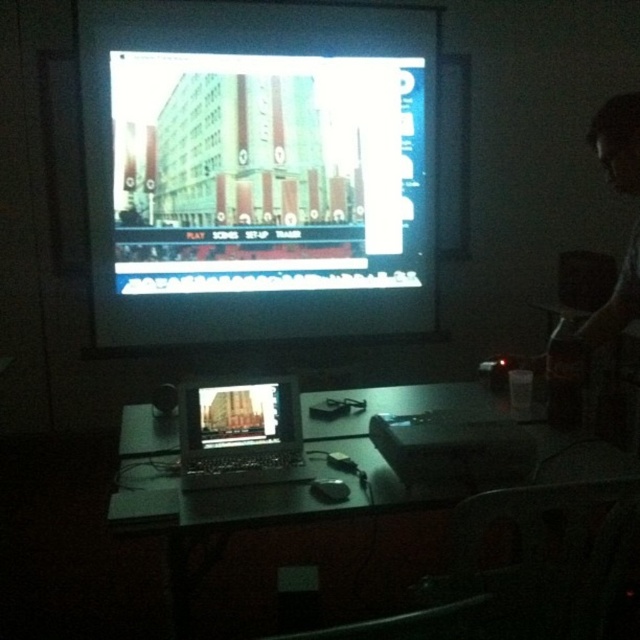
Is bright glossy screen at upper center taller than metallic silver laptop at lower center?

Indeed, bright glossy screen at upper center has a greater height compared to metallic silver laptop at lower center.

Does point (298, 74) come farther from viewer compared to point (387, 404)?

Yes.

You are a GUI agent. You are given a task and a screenshot of the screen. Output one action in this format:
    pyautogui.click(x=<x>, y=<y>)
    Task: Click on the bright glossy screen at upper center
    Image resolution: width=640 pixels, height=640 pixels.
    Given the screenshot: What is the action you would take?
    pyautogui.click(x=257, y=168)

I want to click on bright glossy screen at upper center, so click(x=257, y=168).

Which is behind, point (161, 435) or point (216, 432)?

The point (161, 435) is behind.

Who is taller, metallic silver laptop at lower center or matte silver laptop at center?

With more height is metallic silver laptop at lower center.

What do you see at coordinates (280, 484) in the screenshot?
I see `metallic silver laptop at lower center` at bounding box center [280, 484].

Where is `metallic silver laptop at lower center`? metallic silver laptop at lower center is located at coordinates (280, 484).

Is bright glossy screen at upper center closer to the viewer compared to black plastic laptop at center?

No, it is behind black plastic laptop at center.

Is point (339, 211) more distant than point (252, 406)?

Yes, point (339, 211) is farther from viewer.

Measure the distance between point (90, 120) and camera.

A distance of 3.28 meters exists between point (90, 120) and camera.

I want to click on bright glossy screen at upper center, so click(x=257, y=168).